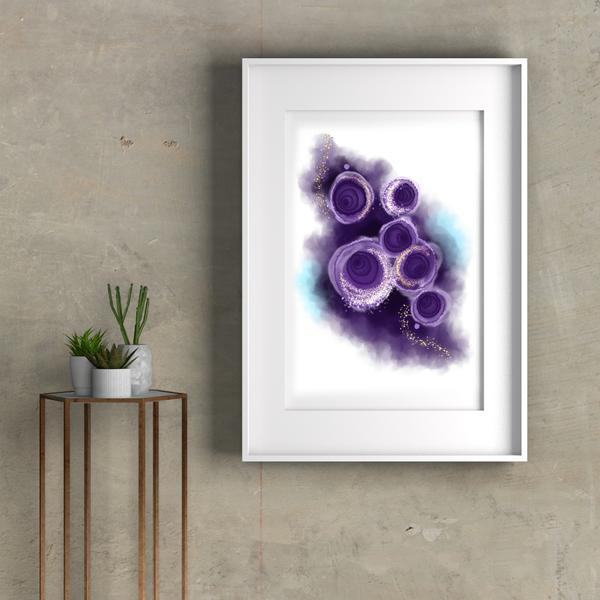
Where is `gray wall`? gray wall is located at coordinates (132, 194).